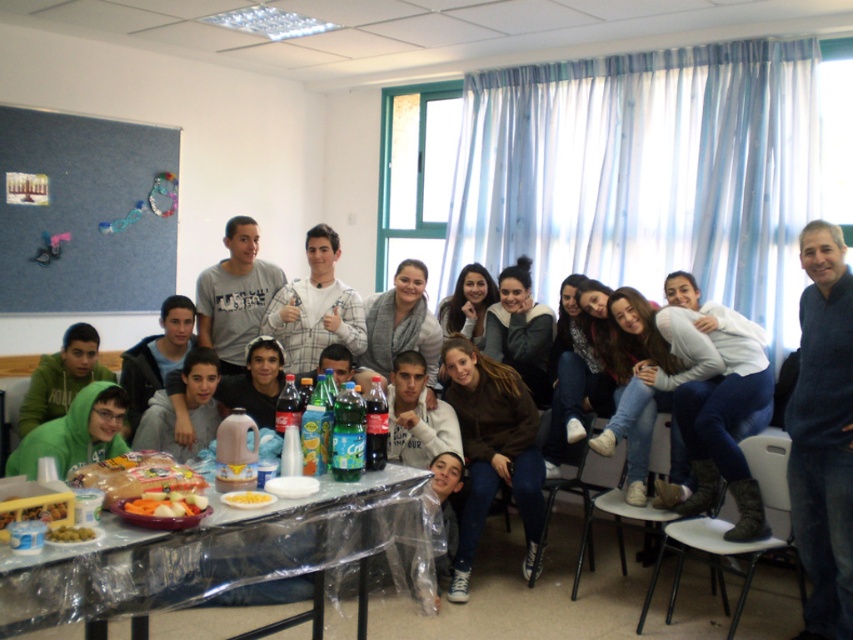
Is point (804, 481) positioned behind point (140, 512)?

Yes, it is.

Is dark blue sweater at right taller than smooth plastic container of mixed vegetables at center?

Yes, dark blue sweater at right is taller than smooth plastic container of mixed vegetables at center.

Who is more distant from viewer, (x=846, y=541) or (x=163, y=500)?

The point (x=846, y=541) is more distant.

This screenshot has height=640, width=853. In order to click on dark blue sweater at right in this screenshot , I will do `click(822, 435)`.

Can you confirm if dark blue sweater at right is shorter than green matte olives at lower left?

Incorrect, dark blue sweater at right's height does not fall short of green matte olives at lower left's.

Where is `dark blue sweater at right`? The image size is (853, 640). dark blue sweater at right is located at coordinates (822, 435).

Can you confirm if smooth plastic container of mixed vegetables at center is positioned to the left of yellow matte corn at center?

Correct, you'll find smooth plastic container of mixed vegetables at center to the left of yellow matte corn at center.

Is point (140, 513) less distant than point (258, 499)?

That is True.

You are a GUI agent. You are given a task and a screenshot of the screen. Output one action in this format:
    pyautogui.click(x=<x>, y=<y>)
    Task: Click on the smooth plastic container of mixed vegetables at center
    Image resolution: width=853 pixels, height=640 pixels.
    Given the screenshot: What is the action you would take?
    pyautogui.click(x=166, y=502)